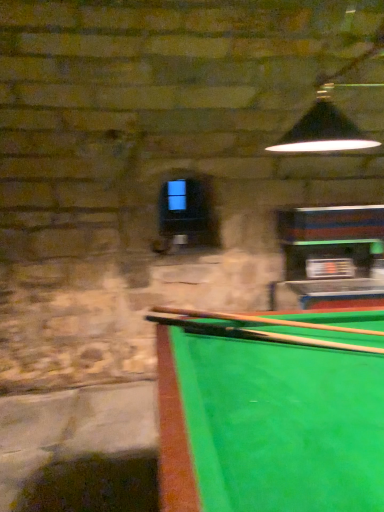
Question: Could you tell me if wooden cue at lower right, which is counted as the first cue, starting from the bottom, is facing smooth wood cue at center, acting as the second cue starting from the bottom?

Choices:
 (A) yes
 (B) no

Answer: (B)

Question: Is wooden cue at lower right, the 3th cue when ordered from top to bottom, next to smooth wood cue at center, which is counted as the second cue, starting from the top?

Choices:
 (A) yes
 (B) no

Answer: (A)

Question: Considering the relative sizes of wooden cue at lower right, the 3th cue when ordered from top to bottom, and smooth wood cue at center, which is counted as the second cue, starting from the top, in the image provided, is wooden cue at lower right, the 3th cue when ordered from top to bottom, shorter than smooth wood cue at center, which is counted as the second cue, starting from the top,?

Choices:
 (A) no
 (B) yes

Answer: (A)

Question: Would you say smooth wood cue at center, which is counted as the second cue, starting from the top, is part of wooden cue at lower right, the 3th cue when ordered from top to bottom,'s contents?

Choices:
 (A) yes
 (B) no

Answer: (B)

Question: Is wooden cue at lower right, which is counted as the first cue, starting from the bottom, at the left side of smooth wood cue at center, acting as the second cue starting from the bottom?

Choices:
 (A) yes
 (B) no

Answer: (B)

Question: Looking at their shapes, would you say smooth wood cue at center, which is counted as the second cue, starting from the top, is wider or thinner than wooden cue at lower right, which is counted as the first cue, starting from the bottom?

Choices:
 (A) thin
 (B) wide

Answer: (B)

Question: Is smooth wood cue at center, acting as the second cue starting from the bottom, inside the boundaries of wooden cue at lower right, which is counted as the first cue, starting from the bottom, or outside?

Choices:
 (A) inside
 (B) outside

Answer: (B)

Question: From a real-world perspective, is smooth wood cue at center, which is counted as the second cue, starting from the top, above or below wooden cue at lower right, the 3th cue when ordered from top to bottom?

Choices:
 (A) above
 (B) below

Answer: (A)

Question: Visually, is smooth wood cue at center, which is counted as the second cue, starting from the top, positioned to the left or to the right of wooden cue at lower right, the 3th cue when ordered from top to bottom?

Choices:
 (A) left
 (B) right

Answer: (A)

Question: From the image's perspective, is smooth wood cue at center, which is counted as the second cue, starting from the top, located above or below wooden cue at center, arranged as the 1th cue when viewed from the top?

Choices:
 (A) above
 (B) below

Answer: (B)

Question: In the image, is smooth wood cue at center, acting as the second cue starting from the bottom, on the left side or the right side of wooden cue at center, arranged as the 1th cue when viewed from the top?

Choices:
 (A) right
 (B) left

Answer: (B)

Question: From a real-world perspective, is smooth wood cue at center, acting as the second cue starting from the bottom, above or below wooden cue at center, arranged as the 1th cue when viewed from the top?

Choices:
 (A) below
 (B) above

Answer: (A)

Question: Choose the correct answer: Is smooth wood cue at center, which is counted as the second cue, starting from the top, inside wooden cue at center, arranged as the 1th cue when viewed from the top, or outside it?

Choices:
 (A) outside
 (B) inside

Answer: (A)

Question: In terms of width, does wooden cue at lower right, the 3th cue when ordered from top to bottom, look wider or thinner when compared to wooden cue at center, arranged as the 1th cue when viewed from the top?

Choices:
 (A) thin
 (B) wide

Answer: (A)

Question: In terms of height, does wooden cue at lower right, the 3th cue when ordered from top to bottom, look taller or shorter compared to wooden cue at center, arranged as the third cue when ordered from the bottom?

Choices:
 (A) short
 (B) tall

Answer: (A)